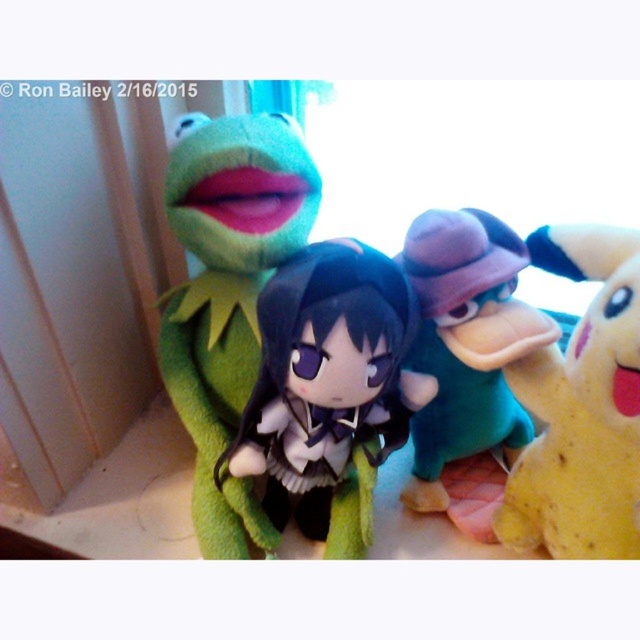
Does green plush frog at upper left come behind yellow plush toy at right?

Yes, green plush frog at upper left is behind yellow plush toy at right.

Does point (269, 214) lie behind point (600, 300)?

Yes, point (269, 214) is behind point (600, 300).

The height and width of the screenshot is (640, 640). Identify the location of green plush frog at upper left. (227, 294).

Does satin black doll at center have a larger size compared to teal plush duck at center?

Yes.

Who is more forward, (317,538) or (481,444)?

→ Point (317,538) is in front.

The width and height of the screenshot is (640, 640). Identify the location of satin black doll at center. (326, 378).

Between velvet green plush frog at upper left and teal plush duck at center, which one is positioned lower?

teal plush duck at center is below.

Between point (609, 540) and point (488, 484), which one is positioned behind?

The point (488, 484) is more distant.

The height and width of the screenshot is (640, 640). Identify the location of velvet green plush frog at upper left. (547, 369).